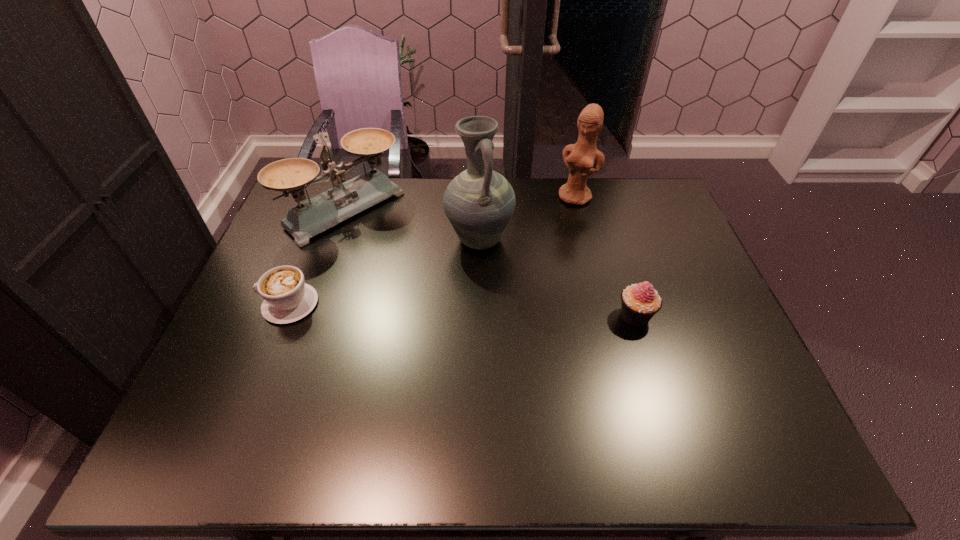
Where is `free region located on the front-facing side of the scale`? free region located on the front-facing side of the scale is located at coordinates (444, 288).

At what (x,y) coordinates should I click in order to perform the action: click on free space located 0.140m on the handle side of the pitcher. Please return your answer as a coordinate pair (x, y). The width and height of the screenshot is (960, 540). Looking at the image, I should click on (469, 298).

Identify the location of vacant space located on the handle side of the pitcher. The image size is (960, 540). (462, 340).

Where is `vacant space situated on the handle side of the pitcher`? vacant space situated on the handle side of the pitcher is located at coordinates point(455,382).

Find the location of a particular element. Image resolution: width=960 pixels, height=540 pixels. free space located on the front-facing side of the figurine is located at coordinates (556, 233).

At what (x,y) coordinates should I click in order to perform the action: click on vacant space situated on the front-facing side of the figurine. Please return your answer as a coordinate pair (x, y). Looking at the image, I should click on (540, 261).

Locate an element on the screen. The image size is (960, 540). free region located on the front-facing side of the figurine is located at coordinates (547, 249).

Image resolution: width=960 pixels, height=540 pixels. In order to click on scale that is at the far edge in this screenshot , I will do `click(315, 215)`.

I want to click on pitcher present at the far edge, so click(479, 203).

I want to click on figurine that is at the far edge, so pos(579,158).